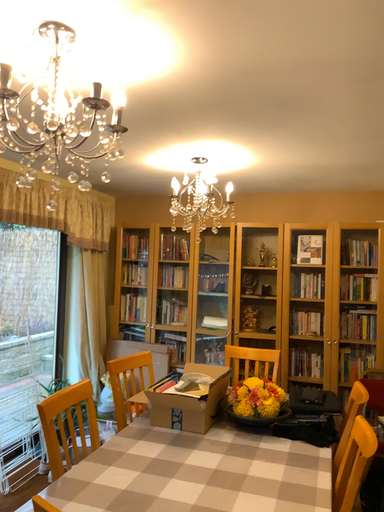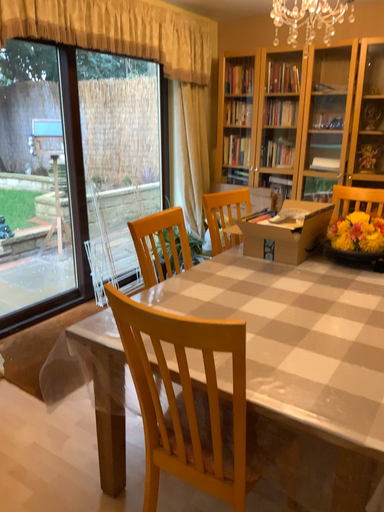
Question: Which way did the camera rotate in the video?

Choices:
 (A) rotated downward
 (B) rotated upward

Answer: (A)